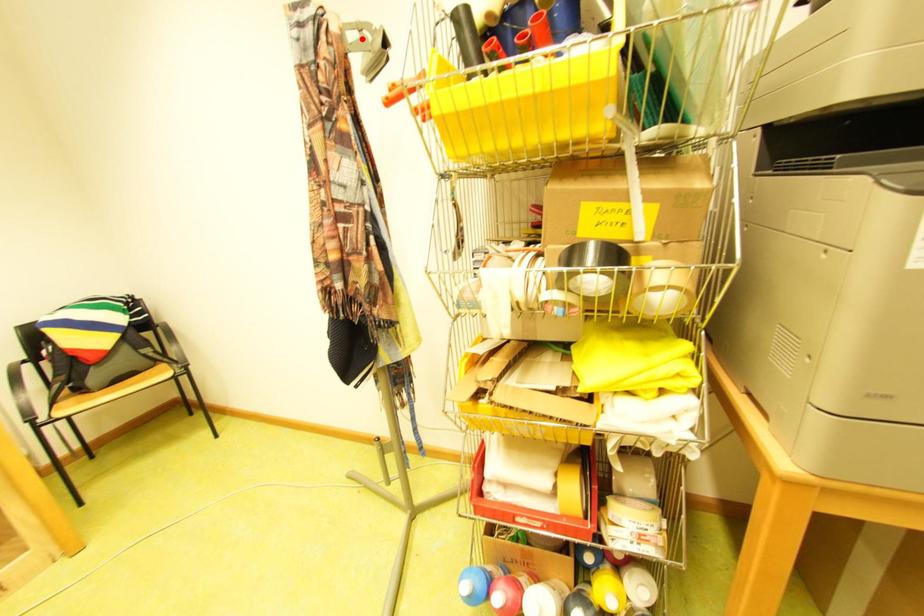
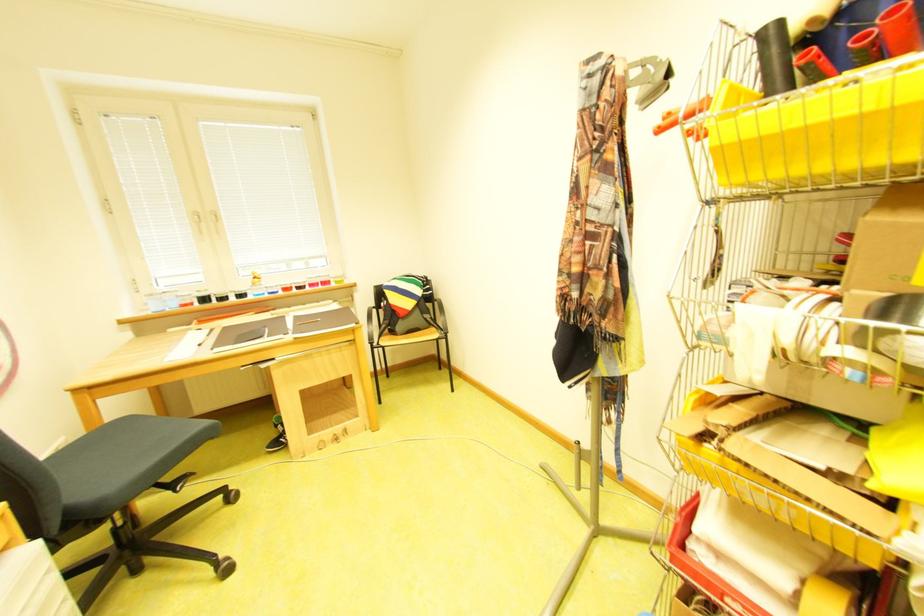
In the second image, find the point that corresponds to the highlighted location in the first image.

(646, 74)